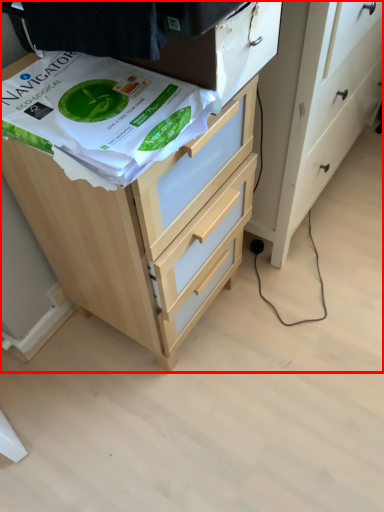
Question: From the image's perspective, where is chest of drawers (annotated by the red box) located relative to wrapping paper?

Choices:
 (A) above
 (B) below

Answer: (B)